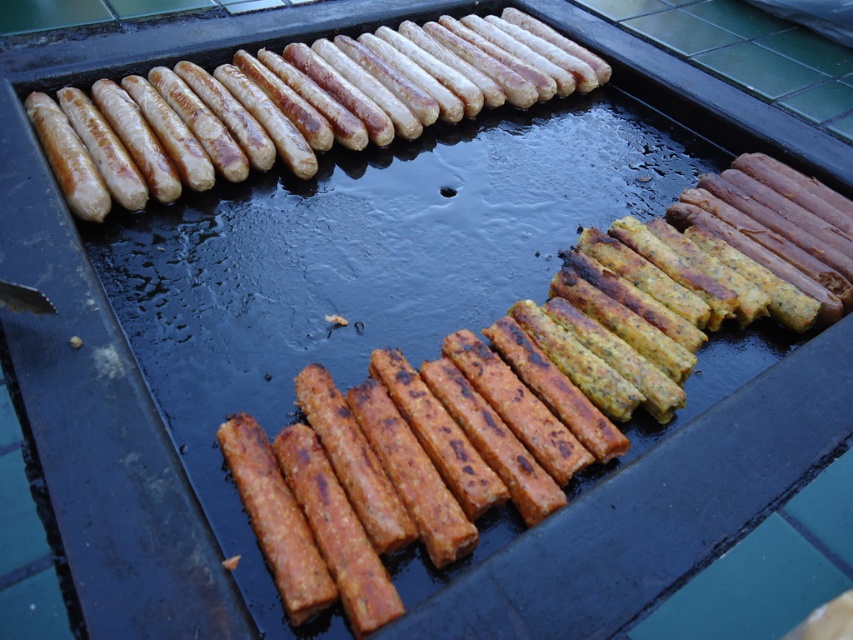
In the scene shown: You are standing in front of the grill and want to grab the sausage at point (109, 115). Is it within arm reach?

The point (109, 115) is 1.84 meters from the viewer, so it is out of arm reach.